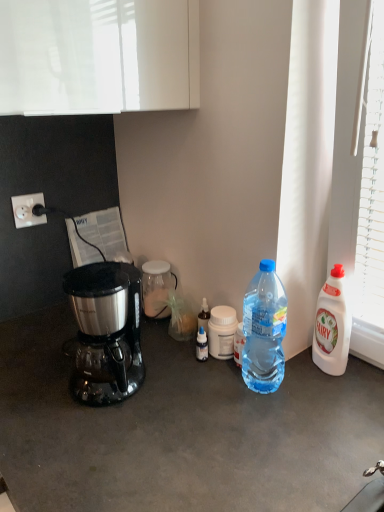
Question: Is white plastic power outlet at left situated inside stainless steel coffee maker at left or outside?

Choices:
 (A) inside
 (B) outside

Answer: (B)

Question: From the image's perspective, is white plastic power outlet at left positioned above or below stainless steel coffee maker at left?

Choices:
 (A) above
 (B) below

Answer: (A)

Question: Which object is positioned farthest from the stainless steel coffee maker at left?

Choices:
 (A) transparent glass jar at center, which appears as the 1th bottle when viewed from the left
 (B) white plastic power outlet at left
 (C) white plastic bottle at center, acting as the second bottle starting from the left
 (D) white plastic bottle at right, the third bottle viewed from the left

Answer: (D)

Question: Which is farther from the transparent glass jar at center, which appears as the first bottle when viewed from the back?

Choices:
 (A) white plastic bottle at right, positioned as the first bottle in front-to-back order
 (B) white plastic bottle at center, positioned as the 2th bottle in front-to-back order
 (C) white plastic power outlet at left
 (D) stainless steel coffee maker at left

Answer: (A)